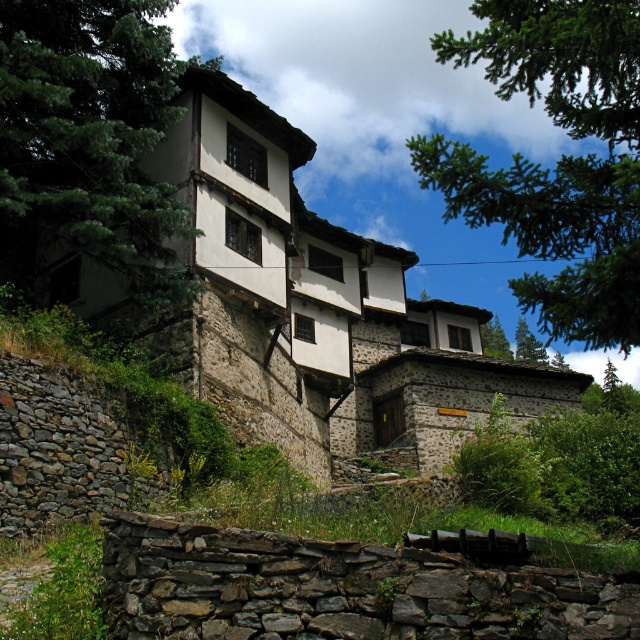
Question: Which object appears farthest from the camera in this image?

Choices:
 (A) green leafy tree at upper left
 (B) green leafy tree at upper center

Answer: (A)

Question: Can you confirm if green leafy tree at upper left is bigger than green leafy tree at center?

Choices:
 (A) yes
 (B) no

Answer: (B)

Question: Can you confirm if green leafy tree at upper center is positioned to the right of green leafy tree at center?

Choices:
 (A) yes
 (B) no

Answer: (B)

Question: Which point is farther to the camera?

Choices:
 (A) (500, 326)
 (B) (60, 45)

Answer: (A)

Question: Can you confirm if green leafy tree at upper left is smaller than green leafy tree at center?

Choices:
 (A) no
 (B) yes

Answer: (B)

Question: Which object appears closest to the camera in this image?

Choices:
 (A) green leafy tree at center
 (B) green leafy tree at upper left

Answer: (B)